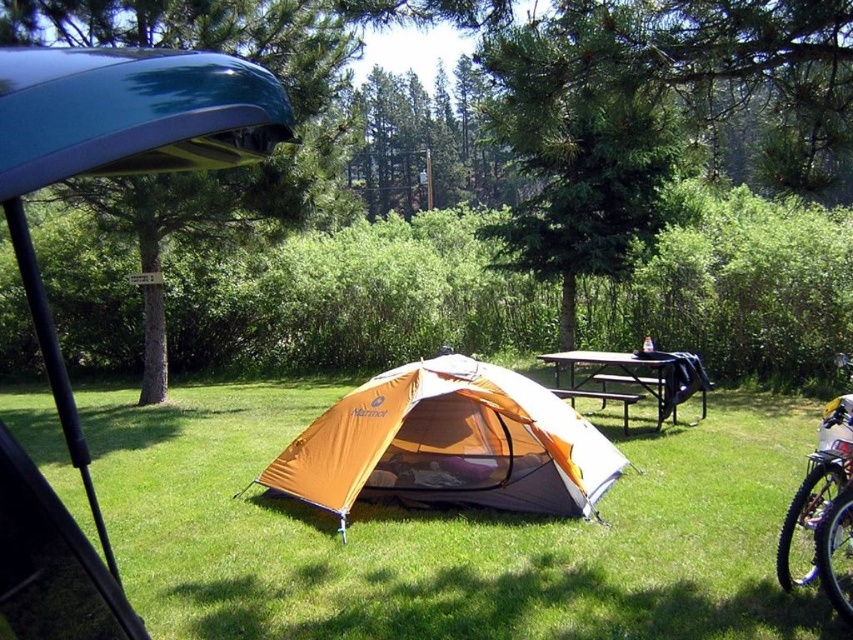
Based on the photo, you are planning to take a short hike from the silver metallic mountain bike at right to the metallic black picnic table at center. Which object will you encounter first if you walk straight towards the picnic table?

The silver metallic mountain bike at right is larger in size than the metallic black picnic table at center, so you will encounter the silver metallic mountain bike at right first as it is closer to you.